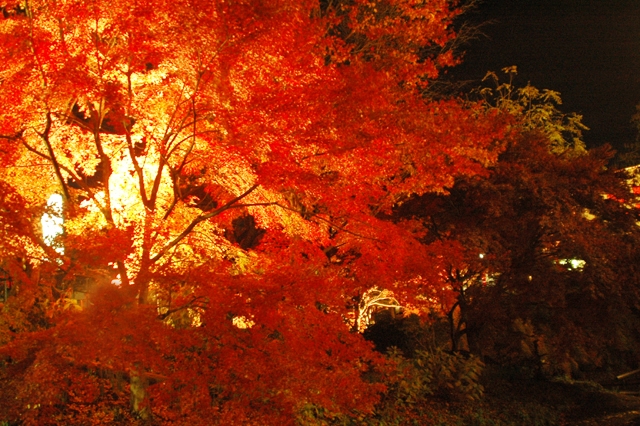
Locate an element on the screen. light is located at coordinates (116, 195).